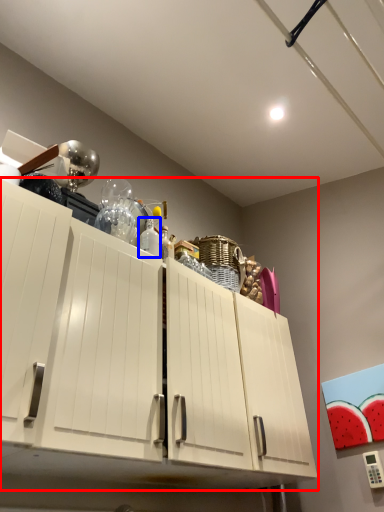
Question: Which of the following is the farthest to the observer, cabinetry (highlighted by a red box) or bottle (highlighted by a blue box)?

Choices:
 (A) cabinetry
 (B) bottle

Answer: (B)